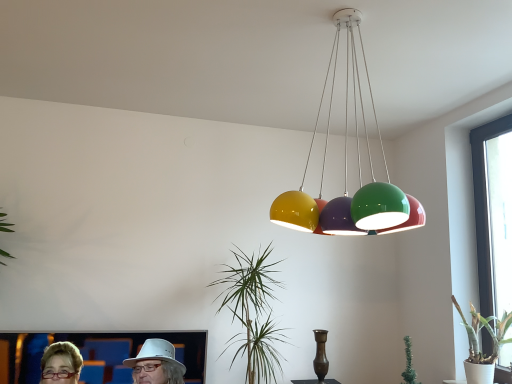
The height and width of the screenshot is (384, 512). What are the coordinates of `bronze metallic vase at center` in the screenshot? It's located at (320, 355).

The width and height of the screenshot is (512, 384). What do you see at coordinates (253, 314) in the screenshot?
I see `green glossy plant at center, acting as the first houseplant starting from the left` at bounding box center [253, 314].

In order to face white ceramic pot at lower right, which ranks as the 2th houseplant in left-to-right order, should I rotate leftwards or rightwards?

A 28.188 degree turn to the right will do.

The image size is (512, 384). In order to click on glossy multicolored globe lights at upper center in this screenshot , I will do `click(347, 174)`.

Choose the correct answer: Is matte white hat at lower left inside white ceramic pot at lower right, arranged as the first houseplant when viewed from the right, or outside it?

matte white hat at lower left lies outside white ceramic pot at lower right, arranged as the first houseplant when viewed from the right.

From the image's perspective, is matte white hat at lower left on white ceramic pot at lower right, which ranks as the 2th houseplant in left-to-right order?

Actually, matte white hat at lower left appears below white ceramic pot at lower right, which ranks as the 2th houseplant in left-to-right order, in the image.

Does matte white hat at lower left have a lesser height compared to white ceramic pot at lower right, which ranks as the 2th houseplant in left-to-right order?

Indeed, matte white hat at lower left has a lesser height compared to white ceramic pot at lower right, which ranks as the 2th houseplant in left-to-right order.

Which is behind, point (451, 298) or point (324, 353)?

Point (451, 298)

Is the surface of white ceramic pot at lower right, arranged as the first houseplant when viewed from the right, in direct contact with bronze metallic vase at center?

They are not placed beside each other.

From a real-world perspective, is white ceramic pot at lower right, which ranks as the 2th houseplant in left-to-right order, positioned above or below bronze metallic vase at center?

In terms of real-world spatial position, white ceramic pot at lower right, which ranks as the 2th houseplant in left-to-right order, is above bronze metallic vase at center.

Does white ceramic pot at lower right, which ranks as the 2th houseplant in left-to-right order, contain bronze metallic vase at center?

No, bronze metallic vase at center is not a part of white ceramic pot at lower right, which ranks as the 2th houseplant in left-to-right order.

Are white ceramic pot at lower right, arranged as the first houseplant when viewed from the right, and green glossy plant at center, acting as the first houseplant starting from the left, far apart?

That's right, there is a large distance between white ceramic pot at lower right, arranged as the first houseplant when viewed from the right, and green glossy plant at center, acting as the first houseplant starting from the left.

Consider the image. Between white ceramic pot at lower right, which ranks as the 2th houseplant in left-to-right order, and green glossy plant at center, which ranks as the 2th houseplant in right-to-left order, which one has smaller width?

Thinner between the two is white ceramic pot at lower right, which ranks as the 2th houseplant in left-to-right order.

Is point (486, 382) closer or farther from the camera than point (258, 347)?

Point (486, 382) appears to be closer to the viewer than point (258, 347).

Which is more to the right, white ceramic pot at lower right, which ranks as the 2th houseplant in left-to-right order, or green glossy plant at center, which ranks as the 2th houseplant in right-to-left order?

white ceramic pot at lower right, which ranks as the 2th houseplant in left-to-right order.

Is bronze metallic vase at center not inside white ceramic pot at lower right, which ranks as the 2th houseplant in left-to-right order?

Absolutely, bronze metallic vase at center is external to white ceramic pot at lower right, which ranks as the 2th houseplant in left-to-right order.

Is bronze metallic vase at center directly adjacent to white ceramic pot at lower right, which ranks as the 2th houseplant in left-to-right order?

They are not placed beside each other.

From a real-world perspective, which object stands above the other?

white ceramic pot at lower right, arranged as the first houseplant when viewed from the right, from a real-world perspective.

Between bronze metallic vase at center and white ceramic pot at lower right, arranged as the first houseplant when viewed from the right, which one appears on the right side from the viewer's perspective?

white ceramic pot at lower right, arranged as the first houseplant when viewed from the right, is more to the right.

Looking at the image, does green glossy plant at center, acting as the first houseplant starting from the left, seem bigger or smaller compared to transparent glass window at right?

Clearly, green glossy plant at center, acting as the first houseplant starting from the left, is larger in size than transparent glass window at right.

Does point (239, 354) come farther from viewer compared to point (480, 293)?

That is True.

From a real-world perspective, which is physically below, green glossy plant at center, which ranks as the 2th houseplant in right-to-left order, or transparent glass window at right?

green glossy plant at center, which ranks as the 2th houseplant in right-to-left order, is physically lower.

Which of these two, transparent glass window at right or white ceramic pot at lower right, which ranks as the 2th houseplant in left-to-right order, is smaller?

transparent glass window at right.

Which object is closer to the camera, transparent glass window at right or white ceramic pot at lower right, which ranks as the 2th houseplant in left-to-right order?

white ceramic pot at lower right, which ranks as the 2th houseplant in left-to-right order, is more forward.

Could you measure the distance between transparent glass window at right and white ceramic pot at lower right, arranged as the first houseplant when viewed from the right?

A distance of 17.66 inches exists between transparent glass window at right and white ceramic pot at lower right, arranged as the first houseplant when viewed from the right.

Is transparent glass window at right oriented towards white ceramic pot at lower right, arranged as the first houseplant when viewed from the right?

Yes, transparent glass window at right is turned towards white ceramic pot at lower right, arranged as the first houseplant when viewed from the right.

Considering the points (333, 232) and (320, 348), which point is in front, point (333, 232) or point (320, 348)?

The point (333, 232) is more forward.

Considering the sizes of glossy multicolored globe lights at upper center and bronze metallic vase at center in the image, is glossy multicolored globe lights at upper center wider or thinner than bronze metallic vase at center?

Considering their sizes, glossy multicolored globe lights at upper center looks broader than bronze metallic vase at center.

From their relative heights in the image, would you say glossy multicolored globe lights at upper center is taller or shorter than bronze metallic vase at center?

glossy multicolored globe lights at upper center is taller than bronze metallic vase at center.

This screenshot has width=512, height=384. In the image, there is a white ceramic pot at lower right, which ranks as the 2th houseplant in left-to-right order. In order to click on couple below it (from the image's perspective) in this screenshot , I will do `click(156, 364)`.

Where is `vase below the white ceramic pot at lower right, which ranks as the 2th houseplant in left-to-right order (from a real-world perspective)`? vase below the white ceramic pot at lower right, which ranks as the 2th houseplant in left-to-right order (from a real-world perspective) is located at coordinates (320, 355).

From the image, which object appears to be nearer to white ceramic pot at lower right, which ranks as the 2th houseplant in left-to-right order, green glossy plant at center, acting as the first houseplant starting from the left, or glossy multicolored globe lights at upper center?

Based on the image, green glossy plant at center, acting as the first houseplant starting from the left, appears to be nearer to white ceramic pot at lower right, which ranks as the 2th houseplant in left-to-right order.

Consider the image. When comparing their distances from transparent glass window at right, does bronze metallic vase at center or glossy multicolored globe lights at upper center seem closer?

→ Based on the image, glossy multicolored globe lights at upper center appears to be nearer to transparent glass window at right.

Estimate the real-world distances between objects in this image. Which object is further from matte white hat at lower left, green glossy plant at center, which ranks as the 2th houseplant in right-to-left order, or transparent glass window at right?

transparent glass window at right.

Which object lies further to the anchor point green glossy plant at center, acting as the first houseplant starting from the left, matte white hat at lower left or glossy multicolored globe lights at upper center?

Among the two, glossy multicolored globe lights at upper center is located further to green glossy plant at center, acting as the first houseplant starting from the left.

When comparing their distances from bronze metallic vase at center, does white ceramic pot at lower right, which ranks as the 2th houseplant in left-to-right order, or matte white hat at lower left seem closer?

white ceramic pot at lower right, which ranks as the 2th houseplant in left-to-right order, is positioned closer to the anchor bronze metallic vase at center.

Based on their spatial positions, is glossy multicolored globe lights at upper center or bronze metallic vase at center further from white ceramic pot at lower right, arranged as the first houseplant when viewed from the right?

Based on the image, glossy multicolored globe lights at upper center appears to be further to white ceramic pot at lower right, arranged as the first houseplant when viewed from the right.

Considering their positions, is matte white hat at lower left positioned further to glossy multicolored globe lights at upper center than bronze metallic vase at center?

The object further to glossy multicolored globe lights at upper center is matte white hat at lower left.

Considering their positions, is glossy multicolored globe lights at upper center positioned further to white ceramic pot at lower right, which ranks as the 2th houseplant in left-to-right order, than transparent glass window at right?

glossy multicolored globe lights at upper center is positioned further to the anchor white ceramic pot at lower right, which ranks as the 2th houseplant in left-to-right order.

The height and width of the screenshot is (384, 512). I want to click on window screen positioned between glossy multicolored globe lights at upper center and bronze metallic vase at center from near to far, so click(x=493, y=213).

This screenshot has height=384, width=512. What are the coordinates of `vase between green glossy plant at center, acting as the first houseplant starting from the left, and white ceramic pot at lower right, arranged as the first houseplant when viewed from the right` in the screenshot? It's located at (320, 355).

This screenshot has height=384, width=512. I want to click on lamp situated between matte white hat at lower left and transparent glass window at right from left to right, so click(x=347, y=174).

Locate an element on the screen. houseplant between matte white hat at lower left and bronze metallic vase at center from left to right is located at coordinates (253, 314).